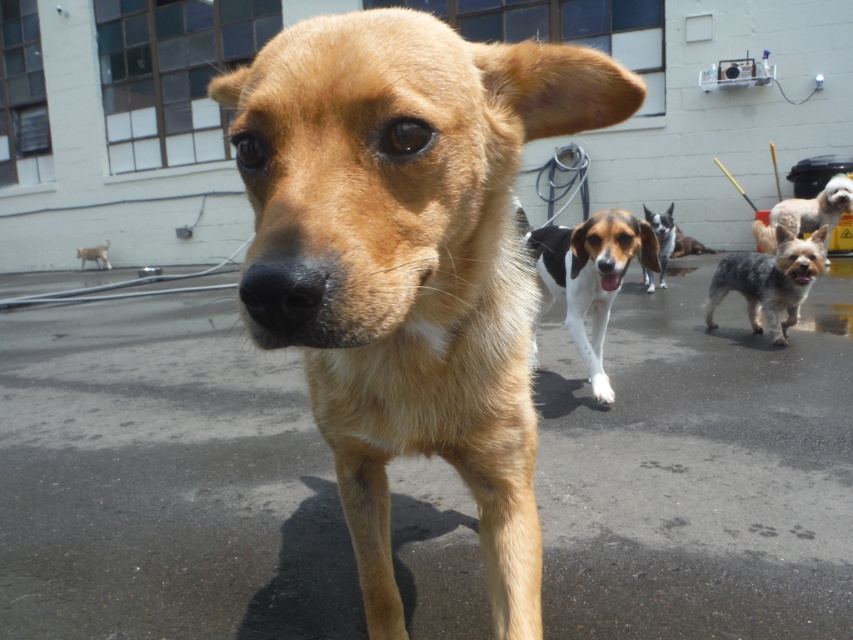
You are a dog trainer standing at the white and black spotted dog at center and want to reach the light brown fur dog at center. Can you walk directly to it without needing to go around any obstacles?

The distance between the white and black spotted dog at center and the light brown fur dog at center is 9.78 meters, so you can walk directly to it without needing to go around any obstacles as there are no mentioned obstacles in the scene.